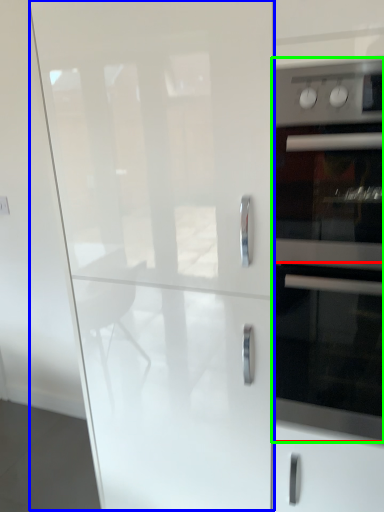
Question: Which object is the farthest from oven (highlighted by a red box)? Choose among these: glass door (highlighted by a blue box) or home appliance (highlighted by a green box).

Choices:
 (A) glass door
 (B) home appliance

Answer: (A)